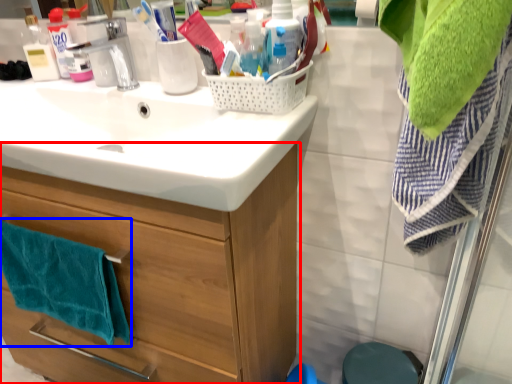
Question: Which point is further to the camera, bathroom cabinet (highlighted by a red box) or bath towel (highlighted by a blue box)?

Choices:
 (A) bathroom cabinet
 (B) bath towel

Answer: (B)